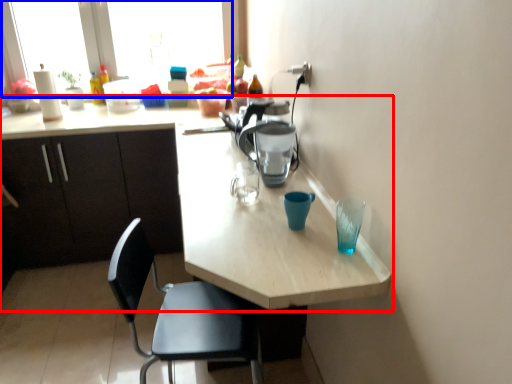
Question: Among these objects, which one is nearest to the camera, kitchen & dining room table (highlighted by a red box) or window screen (highlighted by a blue box)?

Choices:
 (A) kitchen & dining room table
 (B) window screen

Answer: (A)